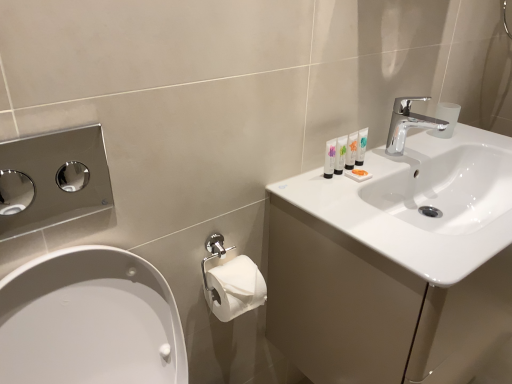
Where is `unoccupied region to the right of white glossy tube at upper right, which is the 3th mouthwash in left-to-right order`? This screenshot has height=384, width=512. unoccupied region to the right of white glossy tube at upper right, which is the 3th mouthwash in left-to-right order is located at coordinates (391, 164).